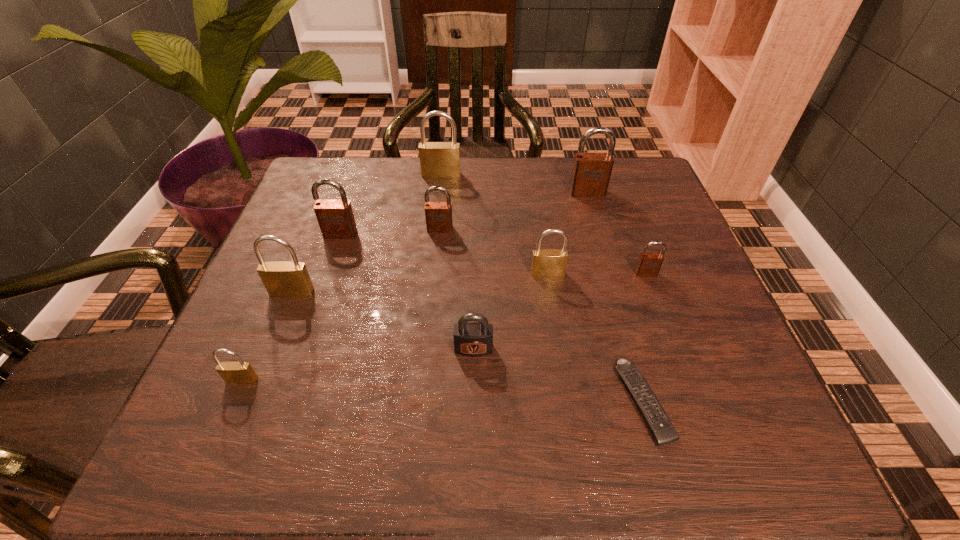
Select which padlock appears as the eighth closest to the smallest brown padlock. Please provide its 2D coordinates. Your answer should be formatted as a tuple, i.e. [(x, y)], where the tuple contains the x and y coordinates of a point satisfying the conditions above.

[(240, 372)]

Where is `brass padlock identified as the second closest to the third nearest padlock`? brass padlock identified as the second closest to the third nearest padlock is located at coordinates (437, 159).

This screenshot has width=960, height=540. Find the location of `the second closest brass padlock to the fourth nearest object`. the second closest brass padlock to the fourth nearest object is located at coordinates (437, 159).

Locate which brown padlock is the closest to the sixth padlock from left to right. Please provide its 2D coordinates. Your answer should be formatted as a tuple, i.e. [(x, y)], where the tuple contains the x and y coordinates of a point satisfying the conditions above.

[(438, 215)]

Select which brown padlock is the second closest to the second farthest brass padlock. Please provide its 2D coordinates. Your answer should be formatted as a tuple, i.e. [(x, y)], where the tuple contains the x and y coordinates of a point satisfying the conditions above.

[(438, 215)]

This screenshot has width=960, height=540. I want to click on free space that satisfies the following two spatial constraints: 1. on the front-facing side of the shortest object; 2. on the left side of the third biggest brown padlock, so click(423, 402).